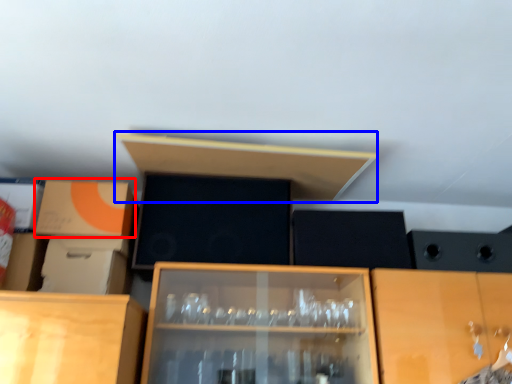
Question: Which point is further to the camera, cardboard box (highlighted by a red box) or shelf (highlighted by a blue box)?

Choices:
 (A) cardboard box
 (B) shelf

Answer: (A)